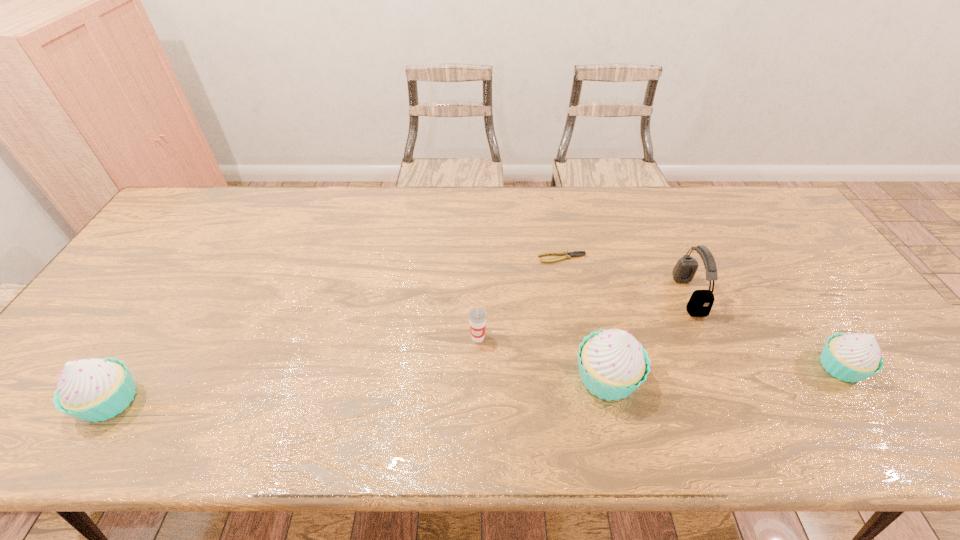
This screenshot has width=960, height=540. I want to click on free space between the leftmost object and the fifth object from left to right, so click(x=399, y=348).

At what (x,y) coordinates should I click in order to perform the action: click on free spot between the second tallest cupcake and the cup. Please return your answer as a coordinate pair (x, y). Looking at the image, I should click on (294, 369).

At what (x,y) coordinates should I click in order to perform the action: click on vacant space that's between the fifth object from right to left and the second cupcake from right to left. Please return your answer as a coordinate pair (x, y). Looking at the image, I should click on (542, 357).

I want to click on vacant region between the rightmost object and the cup, so click(x=660, y=352).

Where is `free space between the second object from left to right and the leftmost object`? Image resolution: width=960 pixels, height=540 pixels. free space between the second object from left to right and the leftmost object is located at coordinates coord(294,369).

You are a GUI agent. You are given a task and a screenshot of the screen. Output one action in this format:
    pyautogui.click(x=<x>, y=<y>)
    Task: Click on the empty space that is in between the leftmost cupcake and the shortest cupcake
    This screenshot has width=960, height=540.
    Given the screenshot: What is the action you would take?
    pyautogui.click(x=475, y=384)

At what (x,y) coordinates should I click in order to perform the action: click on free area in between the headset and the third farthest object. Please return your answer as a coordinate pair (x, y). Looking at the image, I should click on (583, 316).

Choose which object is the fifth nearest neighbor to the shortest cupcake. Please provide its 2D coordinates. Your answer should be formatted as a tuple, i.e. [(x, y)], where the tuple contains the x and y coordinates of a point satisfying the conditions above.

[(92, 389)]

Where is `object that can be found as the third closest to the pliers`? The width and height of the screenshot is (960, 540). object that can be found as the third closest to the pliers is located at coordinates (612, 364).

In order to click on the closest cupcake to the shortest cupcake in this screenshot , I will do `click(612, 364)`.